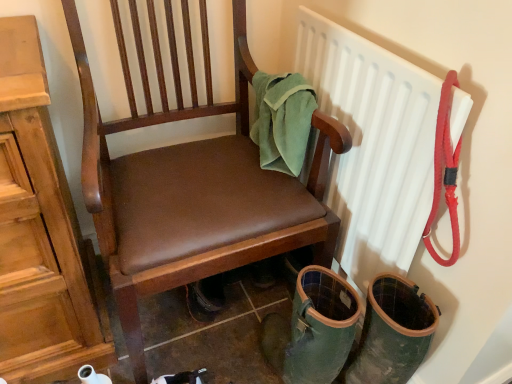
What do you see at coordinates (373, 144) in the screenshot? The height and width of the screenshot is (384, 512). I see `white plastic radiator at upper right` at bounding box center [373, 144].

What do you see at coordinates (192, 182) in the screenshot? This screenshot has width=512, height=384. I see `brown leather chair at center` at bounding box center [192, 182].

The image size is (512, 384). Identify the location of white plastic radiator at upper right. pyautogui.click(x=373, y=144).

Looking at this image, how many degrees apart are the facing directions of white plastic radiator at upper right and brown leather chair at center?

The angular difference between white plastic radiator at upper right and brown leather chair at center is 89.1 degrees.

From the image's perspective, relative to brown leather chair at center, is white plastic radiator at upper right above or below?

white plastic radiator at upper right is situated higher than brown leather chair at center in the image.

Is white plastic radiator at upper right directly adjacent to brown leather chair at center?

No, white plastic radiator at upper right is not next to brown leather chair at center.

Is white plastic radiator at upper right turned away from brown leather chair at center?

Absolutely, white plastic radiator at upper right is directed away from brown leather chair at center.

From the image's perspective, which object appears higher, green felt towel at upper right or white plastic radiator at upper right?

green felt towel at upper right appears higher in the image.

Between green felt towel at upper right and white plastic radiator at upper right, which one is positioned in front?

white plastic radiator at upper right is in front.

Based on the photo, is green felt towel at upper right located outside white plastic radiator at upper right?

green felt towel at upper right is positioned outside white plastic radiator at upper right.

Which of these two, green felt towel at upper right or white plastic radiator at upper right, stands taller?

Standing taller between the two is white plastic radiator at upper right.

Is the surface of brown leather chair at center in direct contact with green felt towel at upper right?

No, brown leather chair at center is not in contact with green felt towel at upper right.

Is brown leather chair at center to the left or to the right of green felt towel at upper right in the image?

brown leather chair at center is positioned on green felt towel at upper right's left side.

From the image's perspective, is brown leather chair at center above green felt towel at upper right?

No, from the image's perspective, brown leather chair at center is not above green felt towel at upper right.

Measure the distance from brown leather chair at center to green felt towel at upper right.

brown leather chair at center and green felt towel at upper right are 7.74 inches apart from each other.

Which object is further away from the camera, white plastic radiator at upper right or green felt towel at upper right?

green felt towel at upper right is further away from the camera.

How distant is white plastic radiator at upper right from green felt towel at upper right?

A distance of 6.77 inches exists between white plastic radiator at upper right and green felt towel at upper right.

From the image's perspective, is white plastic radiator at upper right above or below green felt towel at upper right?

From the image's perspective, white plastic radiator at upper right appears below green felt towel at upper right.

Is white plastic radiator at upper right positioned far away from green felt towel at upper right?

That's not correct — white plastic radiator at upper right is a little close to green felt towel at upper right.

How different are the orientations of brown leather chair at center and white plastic radiator at upper right in degrees?

The angle between the facing direction of brown leather chair at center and the facing direction of white plastic radiator at upper right is 89.1 degrees.

Is brown leather chair at center oriented towards white plastic radiator at upper right?

No, brown leather chair at center does not turn towards white plastic radiator at upper right.

Locate an element on the screen. Image resolution: width=512 pixels, height=384 pixels. chair lying on the left of white plastic radiator at upper right is located at coordinates (192, 182).

Does green felt towel at upper right have a greater height compared to brown leather chair at center?

No.

Would you say brown leather chair at center is part of green felt towel at upper right's contents?

No.

Considering the positions of objects green felt towel at upper right and brown leather chair at center in the image provided, who is more to the left, green felt towel at upper right or brown leather chair at center?

brown leather chair at center.

Where is `chair that appears in front of the white plastic radiator at upper right`? Image resolution: width=512 pixels, height=384 pixels. chair that appears in front of the white plastic radiator at upper right is located at coordinates point(192,182).

I want to click on radiator on the right of green felt towel at upper right, so click(x=373, y=144).

Consider the image. Estimate the real-world distances between objects in this image. Which object is further from brown leather chair at center, white plastic radiator at upper right or green felt towel at upper right?

The object further to brown leather chair at center is white plastic radiator at upper right.

From the image, which object appears to be farther from white plastic radiator at upper right, green felt towel at upper right or brown leather chair at center?

brown leather chair at center lies further to white plastic radiator at upper right than the other object.

Considering their positions, is green felt towel at upper right positioned closer to brown leather chair at center than white plastic radiator at upper right?

Based on the image, green felt towel at upper right appears to be nearer to brown leather chair at center.

From the image, which object appears to be nearer to green felt towel at upper right, brown leather chair at center or white plastic radiator at upper right?

white plastic radiator at upper right lies closer to green felt towel at upper right than the other object.

Considering their positions, is brown leather chair at center positioned closer to white plastic radiator at upper right than green felt towel at upper right?

green felt towel at upper right lies closer to white plastic radiator at upper right than the other object.

Looking at this image, considering their positions, is white plastic radiator at upper right positioned closer to green felt towel at upper right than brown leather chair at center?

Based on the image, white plastic radiator at upper right appears to be nearer to green felt towel at upper right.

This screenshot has width=512, height=384. In order to click on radiator between brown leather chair at center and green felt towel at upper right in the front-back direction in this screenshot , I will do `click(373, 144)`.